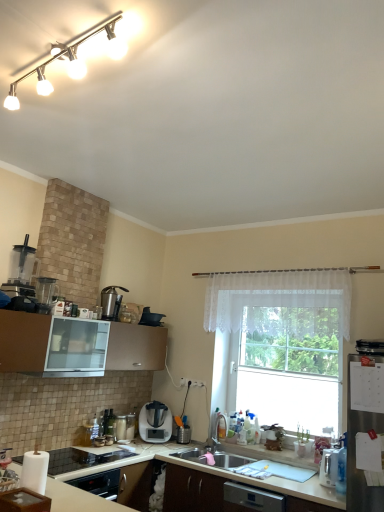
Identify the location of free spot in front of white glossy blender at lower center, which is counted as the 3th appliance, starting from the right. The image size is (384, 512). (131, 443).